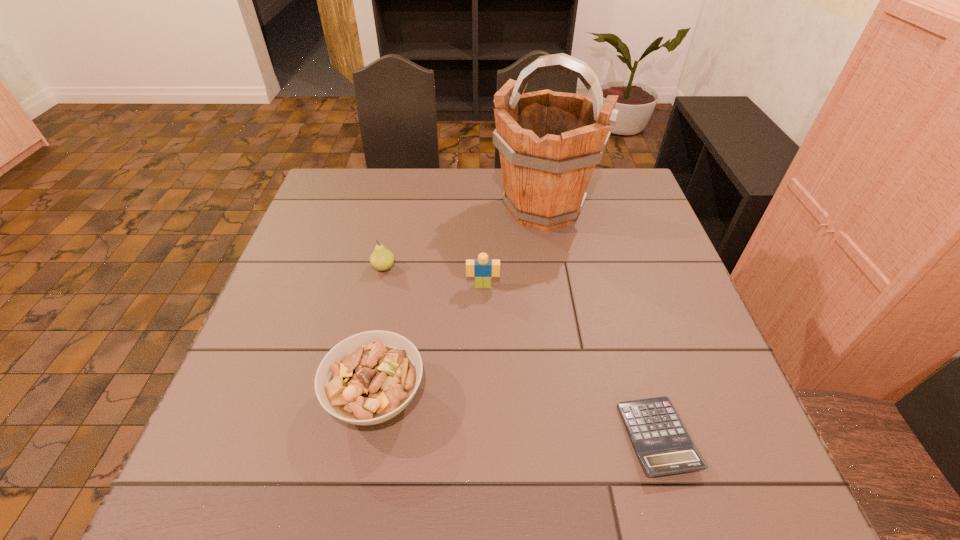
Locate an element on the screen. This screenshot has width=960, height=540. vacant space located on the left of the shortest object is located at coordinates (526, 437).

I want to click on object that is at the far edge, so click(549, 142).

In order to click on object that is positioned at the near edge in this screenshot , I will do `click(663, 445)`.

In order to click on bucket present at the right edge in this screenshot , I will do `click(549, 142)`.

This screenshot has width=960, height=540. What are the coordinates of `calculator situated at the right edge` in the screenshot? It's located at (663, 445).

Find the location of a particular element. This screenshot has width=960, height=540. object located at the far right corner is located at coordinates (549, 142).

Where is `object at the near right corner`? This screenshot has width=960, height=540. object at the near right corner is located at coordinates (663, 445).

At what (x,y) coordinates should I click in order to perform the action: click on vacant space at the far edge of the desktop. Please return your answer as a coordinate pair (x, y). The image size is (960, 540). Looking at the image, I should click on (408, 181).

Locate an element on the screen. The height and width of the screenshot is (540, 960). vacant space at the near edge of the desktop is located at coordinates (303, 454).

At what (x,y) coordinates should I click in order to perform the action: click on free location at the left edge. Please return your answer as a coordinate pair (x, y). Looking at the image, I should click on (286, 345).